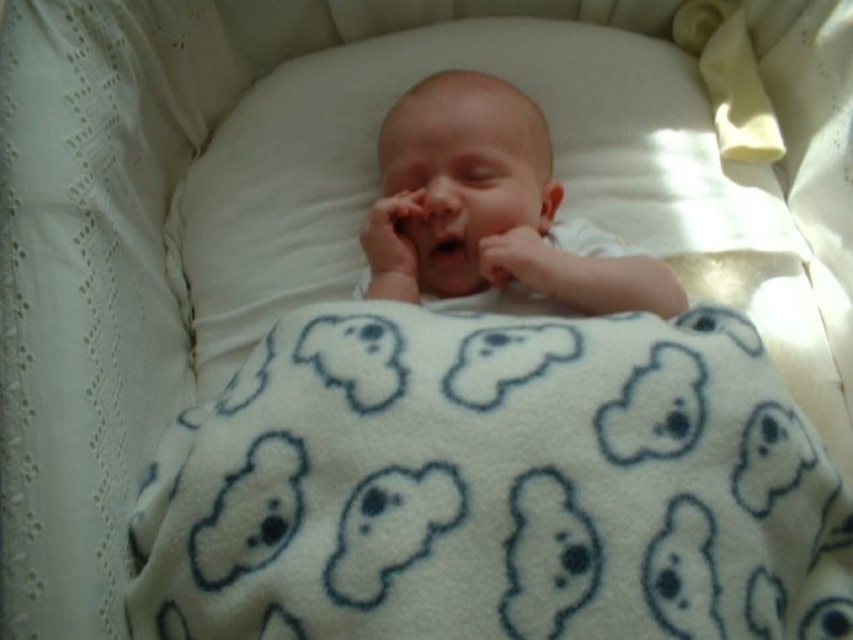
You are a nurse checking on a newborn in the nursery. You see the white soft pillow at center and the smooth white newborn at center. Which object is closer to you?

The white soft pillow at center is closer to you than the smooth white newborn at center.

You are a nurse checking on a newborn in a bassinet. You notice the white soft pillow at center and the smooth white newborn at center. Which object is positioned higher in the bassinet?

The white soft pillow at center is located above the smooth white newborn at center, so the white soft pillow at center is positioned higher in the bassinet.

You are a nurse in a hospital nursery. You need to ensure the smooth white newborn at center is properly covered by the white fleece blanket at center. Based on the size comparison between them, will the blanket sufficiently cover the baby?

The white fleece blanket at center has a larger size compared to smooth white newborn at center, so yes, the blanket will sufficiently cover the baby.